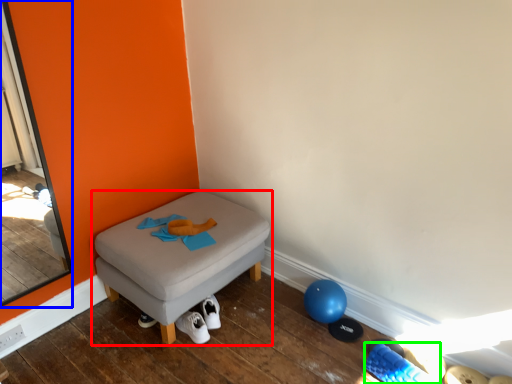
Question: Which object is the closest to the furniture (highlighted by a red box)? Choose among these: screen door (highlighted by a blue box) or footwear (highlighted by a green box).

Choices:
 (A) screen door
 (B) footwear

Answer: (A)